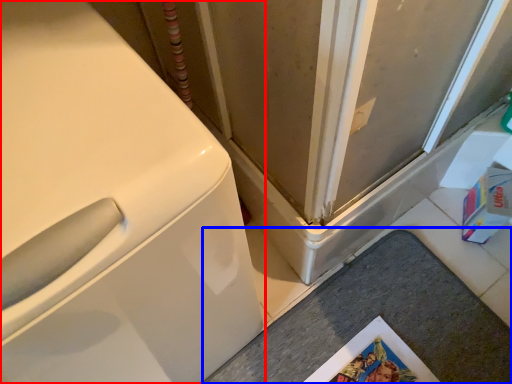
Question: Which point is closer to the camera, washing machine (highlighted by a red box) or counter top (highlighted by a blue box)?

Choices:
 (A) washing machine
 (B) counter top

Answer: (A)